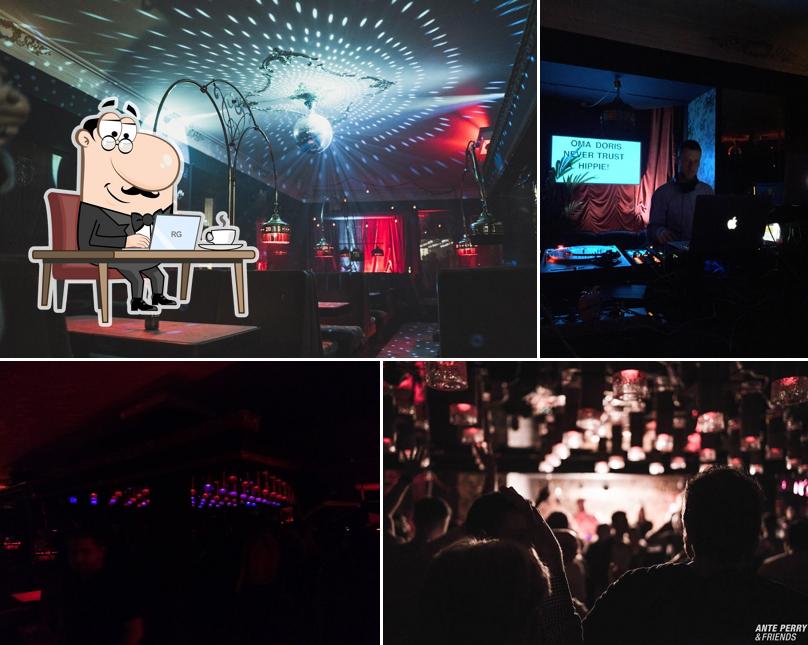
The image size is (808, 645). I want to click on cup of coffee, so click(x=224, y=233).